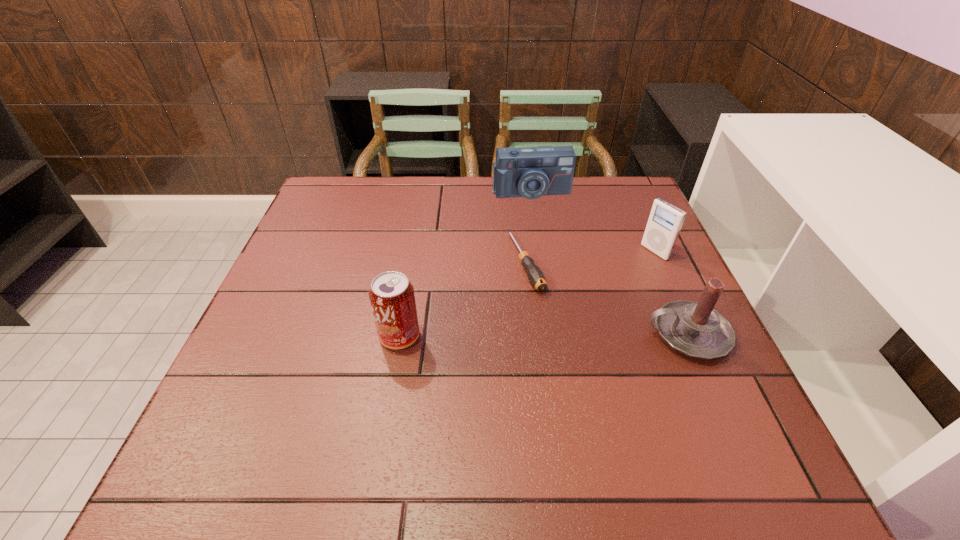
The image size is (960, 540). I want to click on iPod that is at the right edge, so click(x=665, y=221).

Locate an element on the screen. vacant area at the far edge of the desktop is located at coordinates (577, 200).

Locate an element on the screen. This screenshot has width=960, height=540. vacant region at the near edge of the desktop is located at coordinates (443, 402).

Where is `vacant space at the left edge of the desktop`? The image size is (960, 540). vacant space at the left edge of the desktop is located at coordinates (321, 328).

Locate an element on the screen. The height and width of the screenshot is (540, 960). vacant space at the right edge is located at coordinates (624, 223).

Where is `free space at the far left corner of the desktop`? This screenshot has height=540, width=960. free space at the far left corner of the desktop is located at coordinates (313, 205).

At what (x,y) coordinates should I click in order to perform the action: click on free region at the far right corner of the desktop. Please return your answer as a coordinate pair (x, y). The image size is (960, 540). Looking at the image, I should click on (591, 188).

Find the location of a particular element. vacant area that lies between the candle and the soda can is located at coordinates (543, 335).

Locate an element on the screen. Image resolution: width=960 pixels, height=540 pixels. vacant area that lies between the leftmost object and the iPod is located at coordinates (527, 294).

Where is `free spot between the farthest object and the screwdriver`? free spot between the farthest object and the screwdriver is located at coordinates (528, 227).